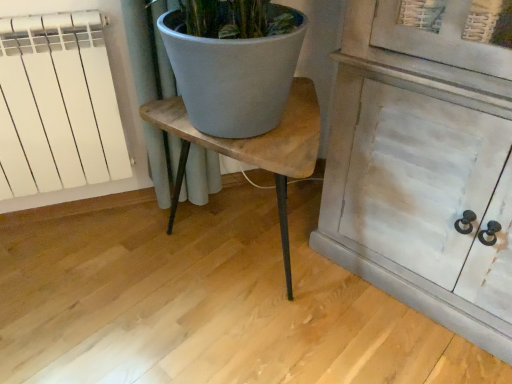
The width and height of the screenshot is (512, 384). I want to click on free space in front of wooden table at center, so click(241, 346).